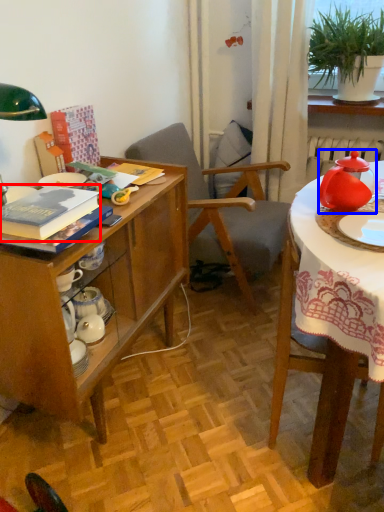
Question: Which of the following is the closest to the observer, book (highlighted by a red box) or tableware (highlighted by a blue box)?

Choices:
 (A) book
 (B) tableware

Answer: (A)